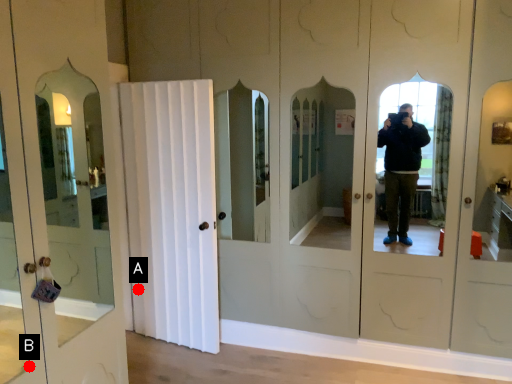
Question: Two points are circled on the image, labeled by A and B beside each circle. Among these points, which one is nearest to the camera?

Choices:
 (A) A is closer
 (B) B is closer

Answer: (B)